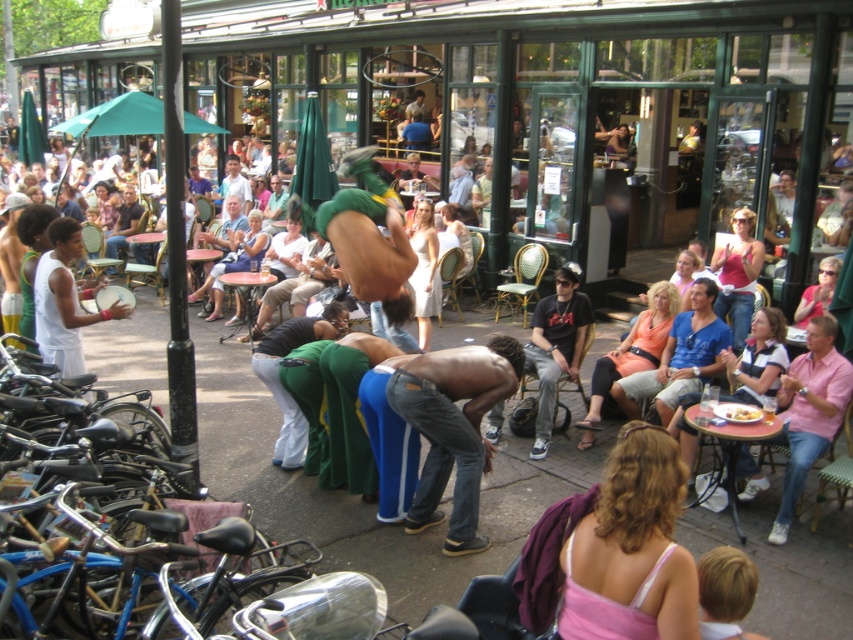
Question: Is denim jeans at center above yellowish matte plate at lower center?

Choices:
 (A) yes
 (B) no

Answer: (B)

Question: Among these objects, which one is nearest to the camera?

Choices:
 (A) denim jeans at center
 (B) yellowish matte plate at lower center

Answer: (A)

Question: Does denim jeans at center have a lesser width compared to yellowish matte plate at lower center?

Choices:
 (A) no
 (B) yes

Answer: (A)

Question: Observing the image, what is the correct spatial positioning of denim jeans at center in reference to yellowish matte plate at lower center?

Choices:
 (A) above
 (B) below

Answer: (B)

Question: Among these objects, which one is nearest to the camera?

Choices:
 (A) denim jeans at center
 (B) yellowish matte plate at lower center

Answer: (A)